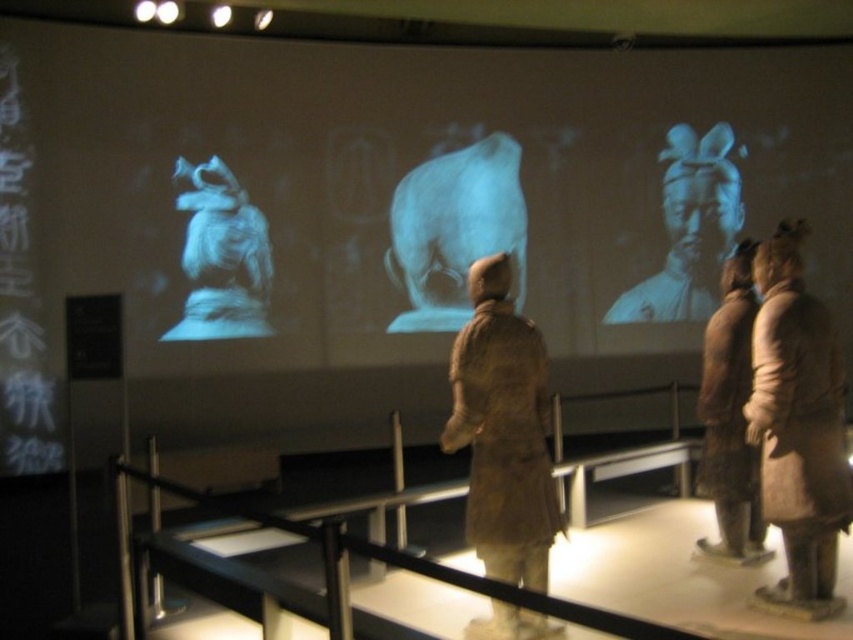
Does brown wool coat at right have a smaller size compared to matte gray statue at upper left?

Indeed, brown wool coat at right has a smaller size compared to matte gray statue at upper left.

Who is positioned more to the right, brown wool coat at right or matte gray statue at upper left?

From the viewer's perspective, brown wool coat at right appears more on the right side.

The width and height of the screenshot is (853, 640). I want to click on brown wool coat at right, so click(x=798, y=428).

You are a GUI agent. You are given a task and a screenshot of the screen. Output one action in this format:
    pyautogui.click(x=<x>, y=<y>)
    Task: Click on the earthenware figure at center
    Image resolution: width=853 pixels, height=640 pixels.
    Given the screenshot: What is the action you would take?
    pyautogui.click(x=503, y=432)

Between earthenware figure at center and matte gray statue at upper left, which one has less height?

earthenware figure at center is shorter.

The height and width of the screenshot is (640, 853). What do you see at coordinates (503, 432) in the screenshot?
I see `earthenware figure at center` at bounding box center [503, 432].

At what (x,y) coordinates should I click in order to perform the action: click on earthenware figure at center. Please return your answer as a coordinate pair (x, y). The height and width of the screenshot is (640, 853). Looking at the image, I should click on (503, 432).

Which is below, brown wool coat at right or brown matte statue at right?

brown wool coat at right

Who is positioned more to the left, brown wool coat at right or brown matte statue at right?

brown wool coat at right

Is point (822, 480) positioned after point (726, 508)?

No, it is not.

Identify the location of brown wool coat at right. (798, 428).